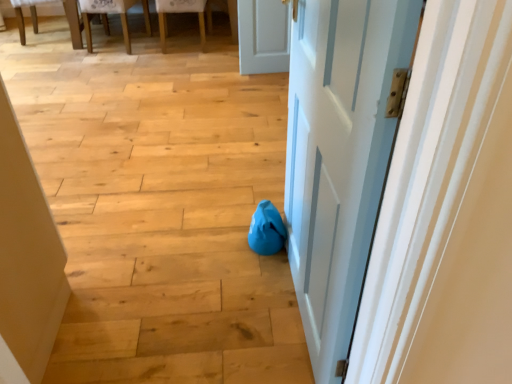
The width and height of the screenshot is (512, 384). I want to click on free space to the left of blue fabric bean bag at center, so click(x=221, y=236).